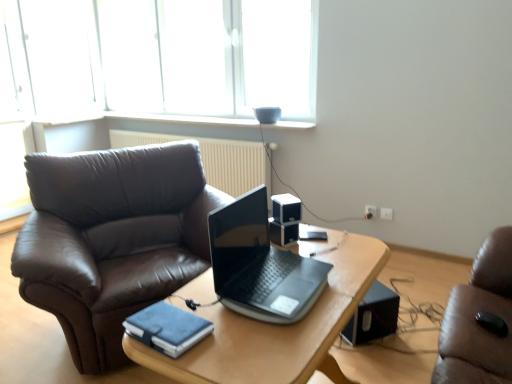
The width and height of the screenshot is (512, 384). I want to click on unoccupied region to the right of black plastic speaker at center, positioned as the 2th loudspeaker in bottom-to-top order, so click(x=318, y=239).